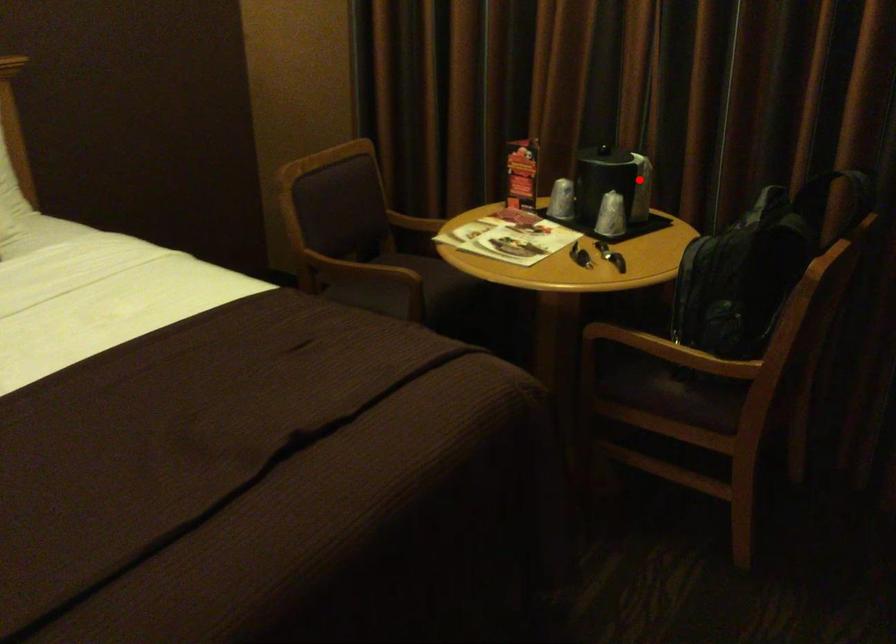
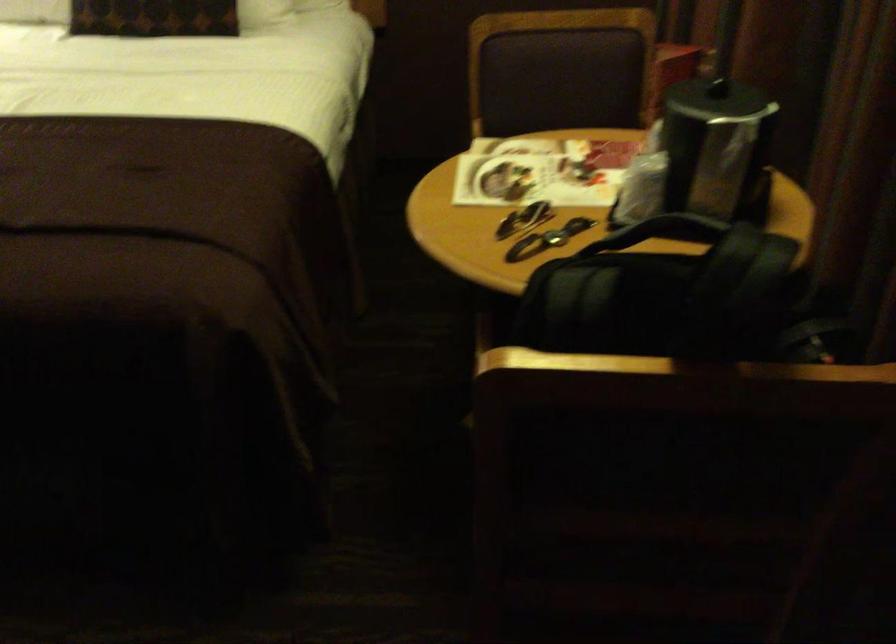
The point at the highlighted location is marked in the first image. Where is the corresponding point in the second image?

(717, 149)